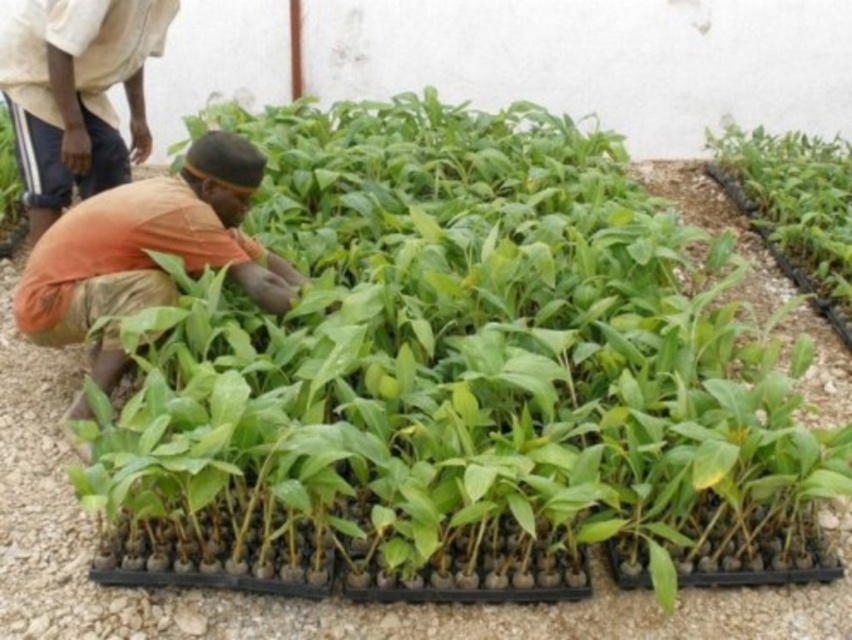
Question: From the image, what is the correct spatial relationship of green leafy plant at upper right in relation to green leafy plant at center?

Choices:
 (A) left
 (B) right

Answer: (B)

Question: Among these points, which one is nearest to the camera?

Choices:
 (A) (746, 179)
 (B) (64, 45)
 (C) (45, 288)

Answer: (C)

Question: Where is green leafy plant at upper right located in relation to green leafy plant at center in the image?

Choices:
 (A) right
 (B) left

Answer: (A)

Question: Estimate the real-world distances between objects in this image. Which object is closer to the green leafy plant at upper right?

Choices:
 (A) orange fabric shirt at lower left
 (B) orange fabric at center

Answer: (B)

Question: Which object is closer to the camera taking this photo?

Choices:
 (A) orange fabric at center
 (B) green leafy plant at center

Answer: (A)

Question: Can you confirm if orange fabric shirt at lower left is positioned to the left of green leafy plant at upper right?

Choices:
 (A) no
 (B) yes

Answer: (B)